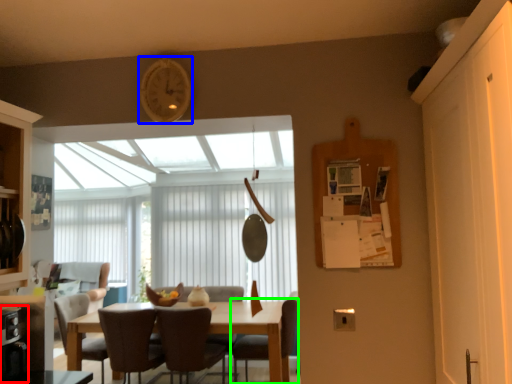
Question: Which object is positioned farthest from appliance (highlighted by a red box)? Select from clock (highlighted by a blue box) and chair (highlighted by a green box).

Choices:
 (A) clock
 (B) chair

Answer: (B)